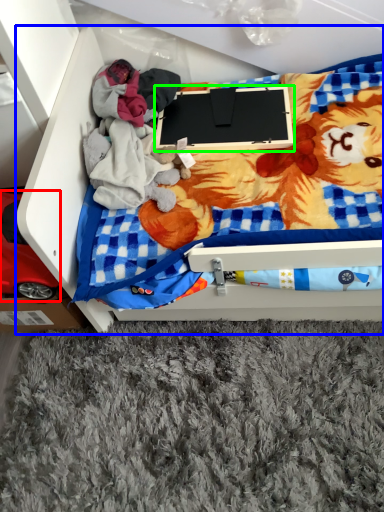
Question: Considering the real-world distances, which object is closest to toy (highlighted by a red box)? furniture (highlighted by a blue box) or laptop (highlighted by a green box).

Choices:
 (A) furniture
 (B) laptop

Answer: (A)